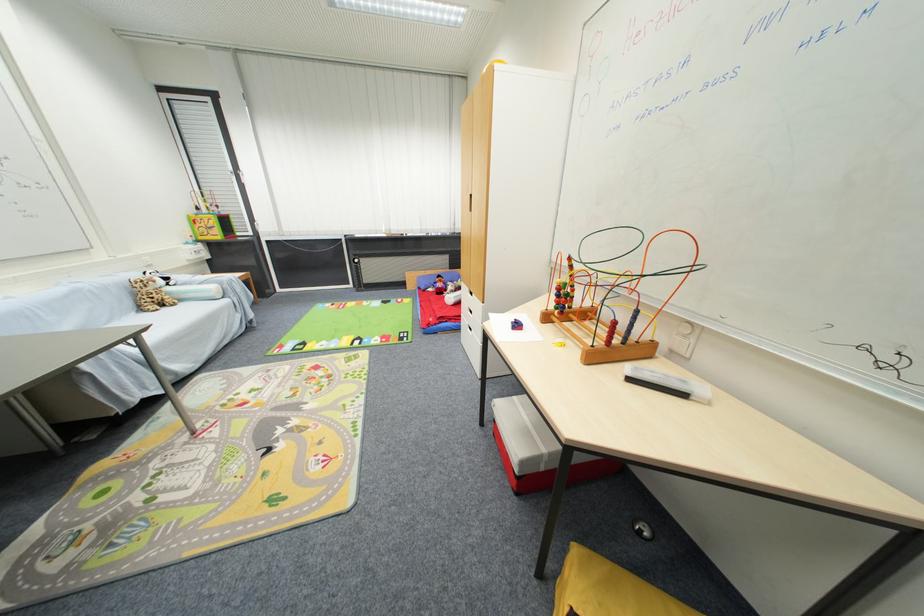
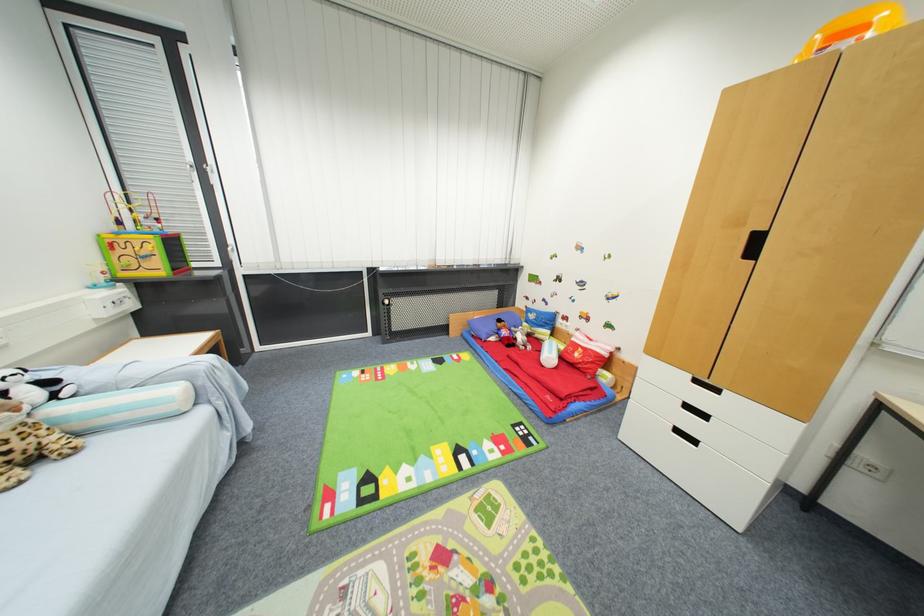
Locate, in the second image, the point that corresponds to (x=444, y=278) in the first image.

(505, 323)